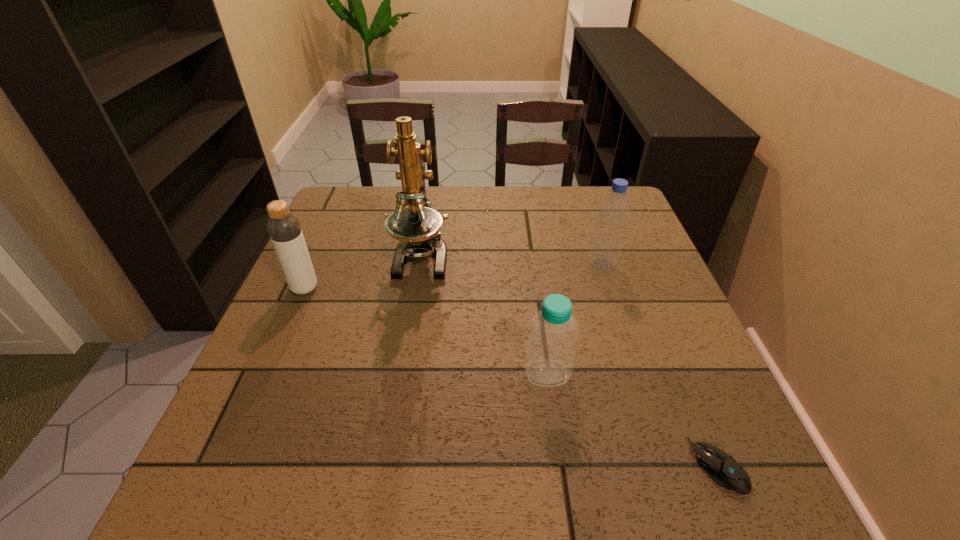
You are a GUI agent. You are given a task and a screenshot of the screen. Output one action in this format:
    pyautogui.click(x=<x>, y=<y>)
    Task: Click on the vacant region that satisfies the following two spatial constraints: 1. on the front side of the second nearest bottle; 2. on the left side of the rightmost object
    
    Given the screenshot: What is the action you would take?
    pyautogui.click(x=226, y=466)

Find the location of a particular element. Image resolution: width=960 pixels, height=540 pixels. vacant space that satisfies the following two spatial constraints: 1. at the eyepiece of the microscope; 2. on the left side of the nearest object is located at coordinates (388, 466).